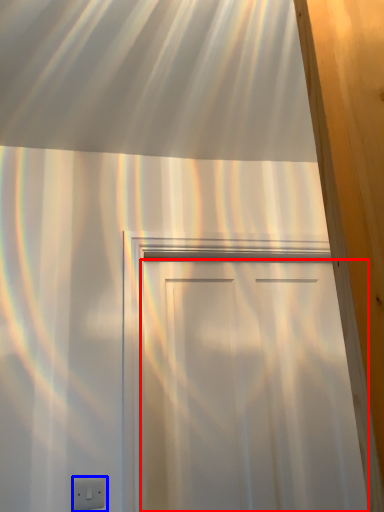
Question: Which point is further to the camera, door (highlighted by a red box) or electric outlet (highlighted by a blue box)?

Choices:
 (A) door
 (B) electric outlet

Answer: (A)